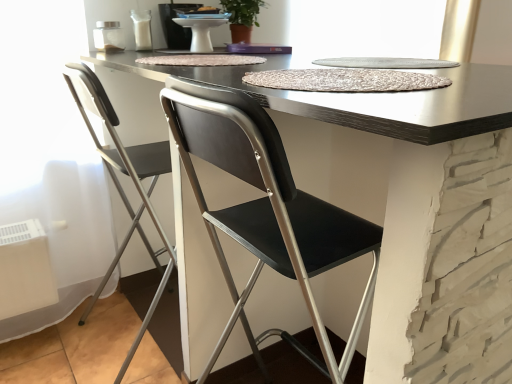
Question: Does white glossy sink at upper center have a greater height compared to matte black table at center?

Choices:
 (A) yes
 (B) no

Answer: (B)

Question: From a real-world perspective, does white glossy sink at upper center stand above matte black table at center?

Choices:
 (A) yes
 (B) no

Answer: (A)

Question: Considering the relative sizes of white glossy sink at upper center and matte black table at center in the image provided, is white glossy sink at upper center smaller than matte black table at center?

Choices:
 (A) no
 (B) yes

Answer: (B)

Question: Would you consider white glossy sink at upper center to be distant from matte black table at center?

Choices:
 (A) no
 (B) yes

Answer: (B)

Question: Considering the relative positions of white glossy sink at upper center and matte black table at center in the image provided, is white glossy sink at upper center to the left of matte black table at center from the viewer's perspective?

Choices:
 (A) no
 (B) yes

Answer: (B)

Question: In terms of height, does white glossy sink at upper center look taller or shorter compared to matte black table at center?

Choices:
 (A) tall
 (B) short

Answer: (B)

Question: Is point (174, 4) positioned closer to the camera than point (398, 248)?

Choices:
 (A) closer
 (B) farther

Answer: (B)

Question: Considering the positions of white glossy sink at upper center and matte black table at center in the image, is white glossy sink at upper center wider or thinner than matte black table at center?

Choices:
 (A) wide
 (B) thin

Answer: (B)

Question: In the image, is white glossy sink at upper center positioned in front of or behind matte black table at center?

Choices:
 (A) front
 (B) behind

Answer: (B)

Question: Considering the positions of matte black table at center and white glossy sink at upper center in the image, is matte black table at center wider or thinner than white glossy sink at upper center?

Choices:
 (A) thin
 (B) wide

Answer: (B)

Question: Based on their positions, is matte black table at center located to the left or right of white glossy sink at upper center?

Choices:
 (A) left
 (B) right

Answer: (B)

Question: From the image's perspective, is matte black table at center above or below white glossy sink at upper center?

Choices:
 (A) above
 (B) below

Answer: (B)

Question: From a real-world perspective, relative to white glossy sink at upper center, is matte black table at center vertically above or below?

Choices:
 (A) below
 (B) above

Answer: (A)

Question: Visually, is metallic silver folding chair at left positioned to the left or to the right of matte black table at center?

Choices:
 (A) right
 (B) left

Answer: (B)

Question: From a real-world perspective, relative to matte black table at center, is metallic silver folding chair at left vertically above or below?

Choices:
 (A) above
 (B) below

Answer: (A)